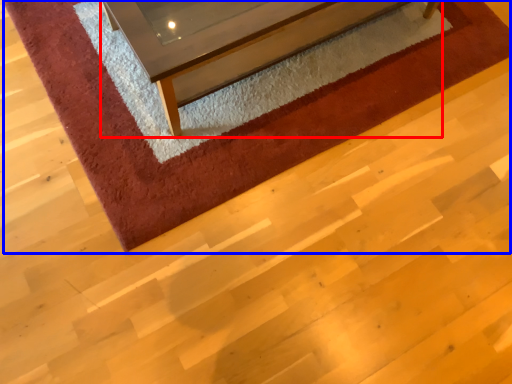
Question: Which object appears closest to the camera in this image, furniture (highlighted by a red box) or mat (highlighted by a blue box)?

Choices:
 (A) furniture
 (B) mat

Answer: (A)